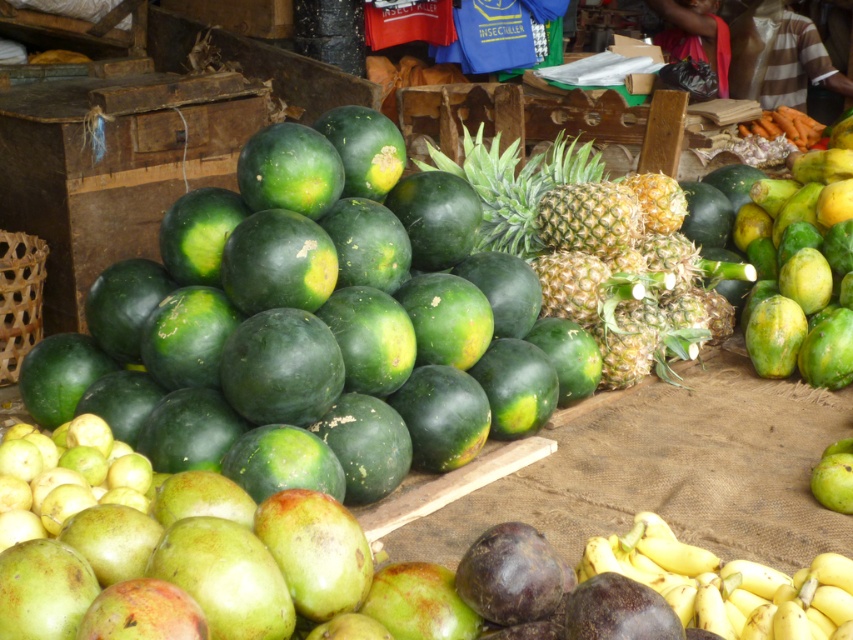
Question: Which object is farther from the camera taking this photo?

Choices:
 (A) yellow-green textured pineapple at center
 (B) yellow matte bananas at lower right
 (C) green matte melon at center

Answer: (A)

Question: Does green matte melon at center have a larger size compared to yellow-green textured pineapple at center?

Choices:
 (A) yes
 (B) no

Answer: (A)

Question: Is yellow-green textured pineapple at center to the right of yellow matte bananas at lower right from the viewer's perspective?

Choices:
 (A) no
 (B) yes

Answer: (B)

Question: In this image, where is green matte melon at center located relative to yellow-green textured pineapple at center?

Choices:
 (A) above
 (B) below

Answer: (B)

Question: Which of the following is the farthest from the observer?

Choices:
 (A) green matte melon at center
 (B) yellow matte bananas at lower right

Answer: (A)

Question: Which of these objects is positioned farthest from the yellow-green textured pineapple at center?

Choices:
 (A) yellow matte bananas at lower right
 (B) green matte melon at center

Answer: (A)